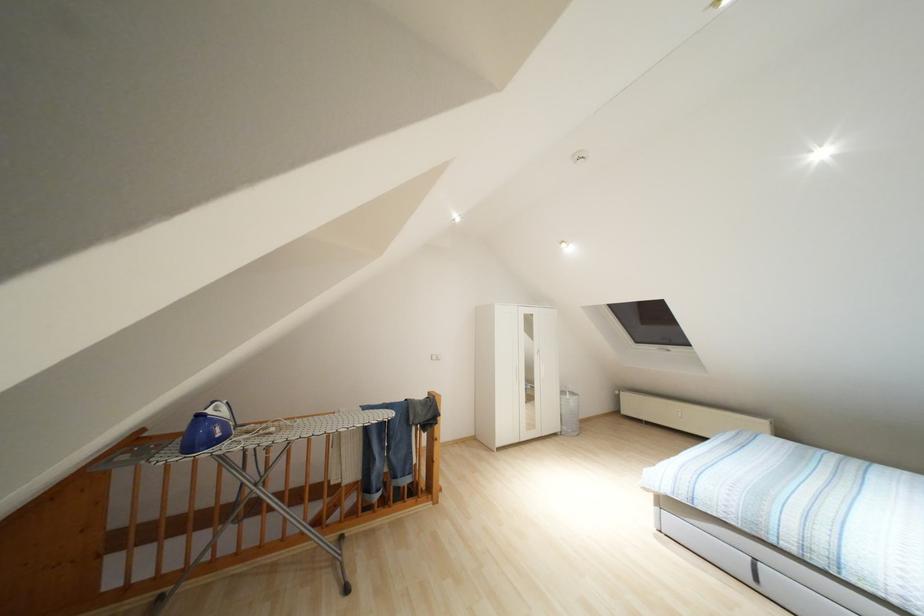
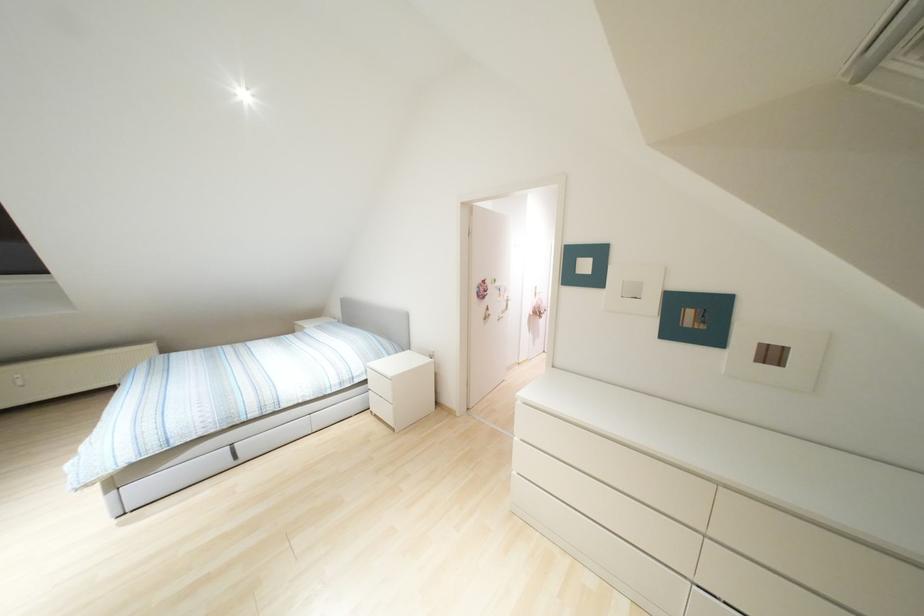
Question: The camera is either moving clockwise (left) or counter-clockwise (right) around the object. The first image is from the beginning of the video and the second image is from the end. Is the camera moving left or right when shooting the video?

Choices:
 (A) Left
 (B) Right

Answer: (A)